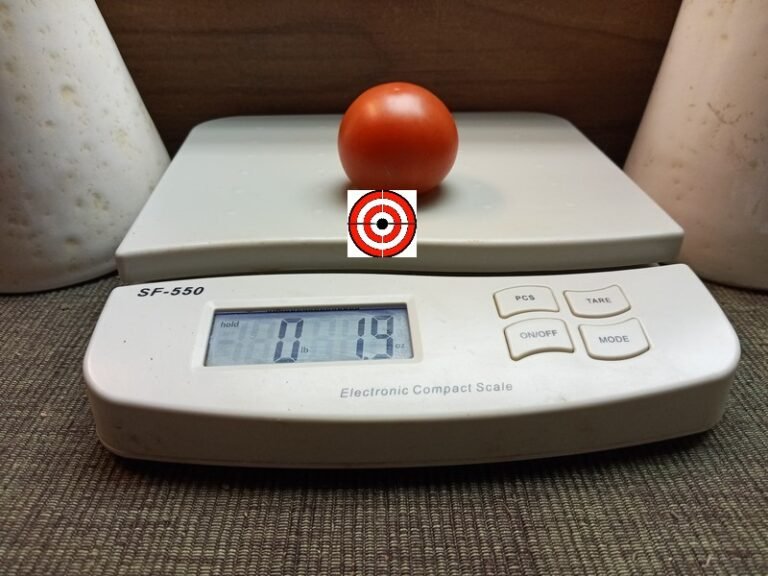
Identify the location of tan wood background. The image size is (768, 576). click(x=280, y=73).